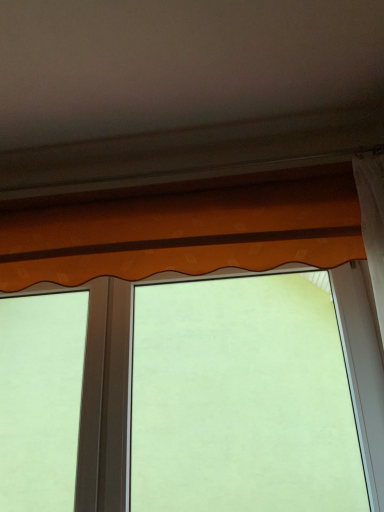
Question: Does orange fabric valance at center come behind orange fabric curtain at upper center?

Choices:
 (A) no
 (B) yes

Answer: (B)

Question: Is orange fabric valance at center oriented towards orange fabric curtain at upper center?

Choices:
 (A) no
 (B) yes

Answer: (B)

Question: Considering the relative sizes of orange fabric valance at center and orange fabric curtain at upper center in the image provided, is orange fabric valance at center wider than orange fabric curtain at upper center?

Choices:
 (A) yes
 (B) no

Answer: (B)

Question: From a real-world perspective, does orange fabric valance at center sit lower than orange fabric curtain at upper center?

Choices:
 (A) yes
 (B) no

Answer: (A)

Question: Does orange fabric valance at center have a smaller size compared to orange fabric curtain at upper center?

Choices:
 (A) no
 (B) yes

Answer: (A)

Question: Are orange fabric valance at center and orange fabric curtain at upper center beside each other?

Choices:
 (A) no
 (B) yes

Answer: (A)

Question: From the image's perspective, is orange fabric curtain at upper center below orange fabric valance at center?

Choices:
 (A) no
 (B) yes

Answer: (A)

Question: From a real-world perspective, is orange fabric curtain at upper center physically above orange fabric valance at center?

Choices:
 (A) yes
 (B) no

Answer: (A)

Question: From a real-world perspective, is orange fabric curtain at upper center under orange fabric valance at center?

Choices:
 (A) yes
 (B) no

Answer: (B)

Question: Does orange fabric curtain at upper center turn towards orange fabric valance at center?

Choices:
 (A) yes
 (B) no

Answer: (B)

Question: Is orange fabric curtain at upper center not inside orange fabric valance at center?

Choices:
 (A) yes
 (B) no

Answer: (A)

Question: Considering the relative sizes of orange fabric curtain at upper center and orange fabric valance at center in the image provided, is orange fabric curtain at upper center bigger than orange fabric valance at center?

Choices:
 (A) yes
 (B) no

Answer: (B)

Question: Which is correct: orange fabric valance at center is inside orange fabric curtain at upper center, or outside of it?

Choices:
 (A) outside
 (B) inside

Answer: (A)